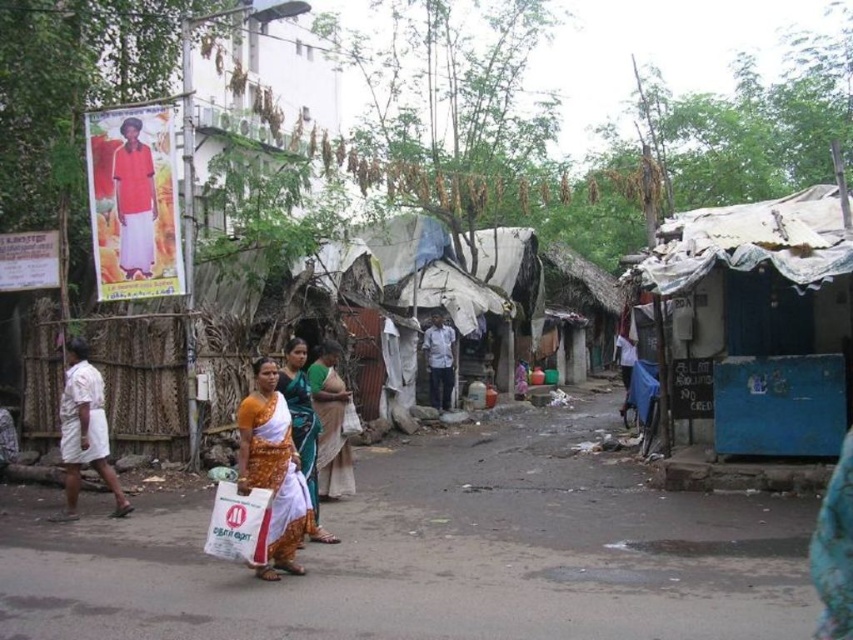
Question: Which is nearer to the white cotton shirt at left?

Choices:
 (A) matte orange sari at center
 (B) blue tarpaulin hut at right
 (C) matte red shirt at upper left

Answer: (A)

Question: Is orange cotton saree at center above white cotton shirt at center?

Choices:
 (A) no
 (B) yes

Answer: (A)

Question: Can you confirm if white cotton shirt at left is wider than white cotton shirt at center?

Choices:
 (A) yes
 (B) no

Answer: (A)

Question: Which object is the farthest from the matte orange sari at center?

Choices:
 (A) green silk saree at center
 (B) white cotton shirt at left

Answer: (B)

Question: Is orange cotton saree at center smaller than matte red shirt at upper left?

Choices:
 (A) yes
 (B) no

Answer: (B)

Question: Which point is farther to the camera?

Choices:
 (A) (115, 506)
 (B) (135, 128)
 (C) (273, 458)

Answer: (B)